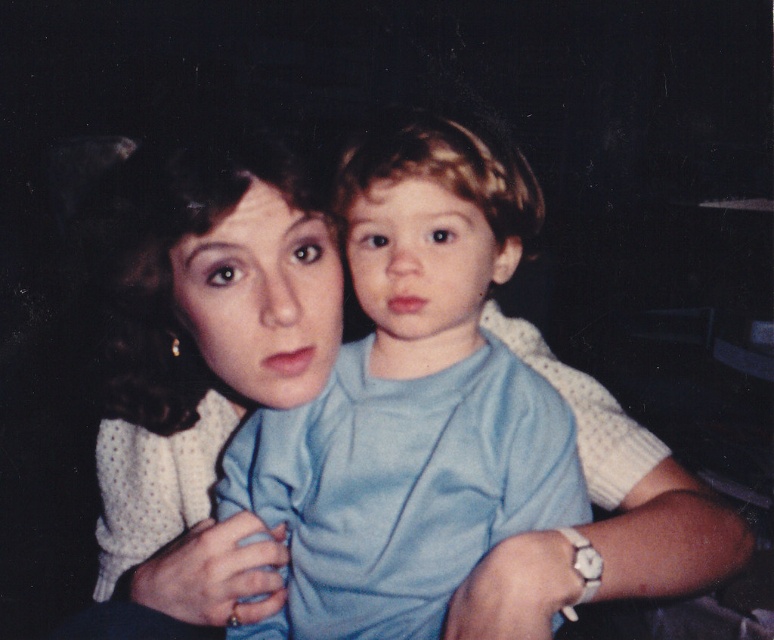
Question: Does light blue cotton shirt at center appear on the right side of white dotted sweater at upper left?

Choices:
 (A) yes
 (B) no

Answer: (A)

Question: Considering the relative positions of light blue cotton shirt at center and white dotted sweater at upper left in the image provided, where is light blue cotton shirt at center located with respect to white dotted sweater at upper left?

Choices:
 (A) above
 (B) below

Answer: (A)

Question: Can you confirm if light blue cotton shirt at center is positioned to the left of white dotted sweater at upper left?

Choices:
 (A) yes
 (B) no

Answer: (B)

Question: Which point is farther to the camera?

Choices:
 (A) (249, 172)
 (B) (330, 632)

Answer: (B)

Question: Which point is farther to the camera?

Choices:
 (A) (432, 262)
 (B) (112, 467)

Answer: (B)